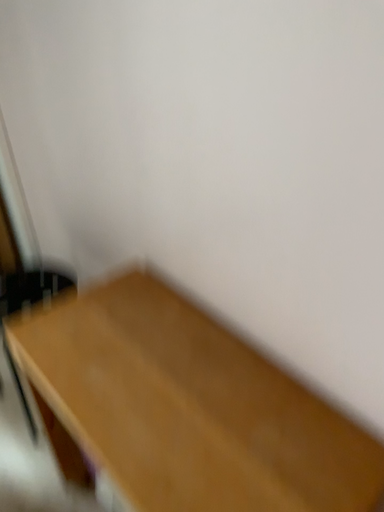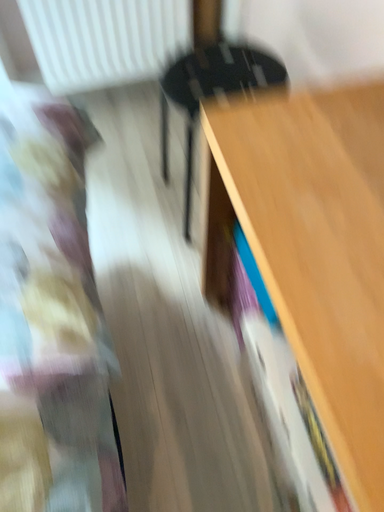
Question: Which way did the camera rotate in the video?

Choices:
 (A) rotated left
 (B) rotated right

Answer: (A)